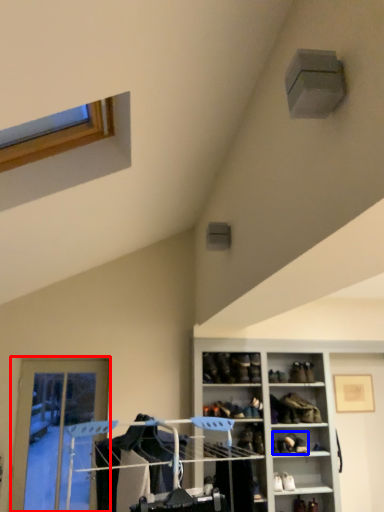
Question: Which object appears closest to the camera in this image, door (highlighted by a red box) or footwear (highlighted by a blue box)?

Choices:
 (A) door
 (B) footwear

Answer: (B)